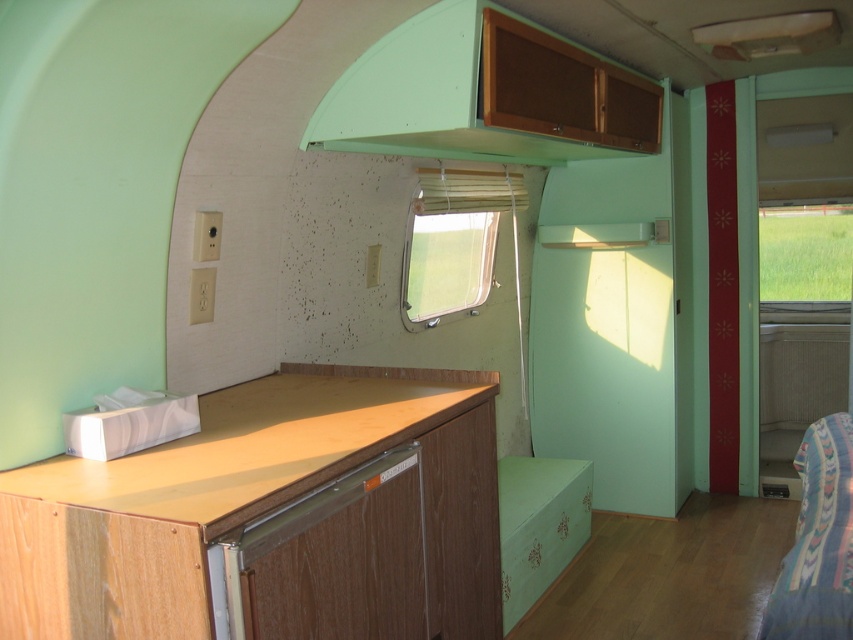
You are designing a new trailer and want to replace the clear plastic window at center and the green glass window at right with identical panes. However, you need to ensure that the new panes match the thickness of the thicker existing window. Which existing window should you use as a reference for the thickness?

The green glass window at right is thicker than the clear plastic window at center, so you should use the green glass window at right as the reference for the thickness.